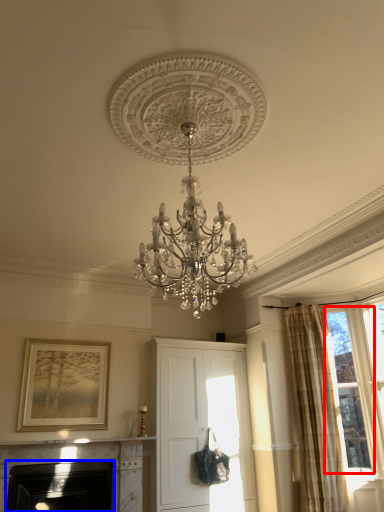
Question: Which of the following is the closest to the observer, bay window (highlighted by a red box) or fireplace (highlighted by a blue box)?

Choices:
 (A) bay window
 (B) fireplace

Answer: (B)